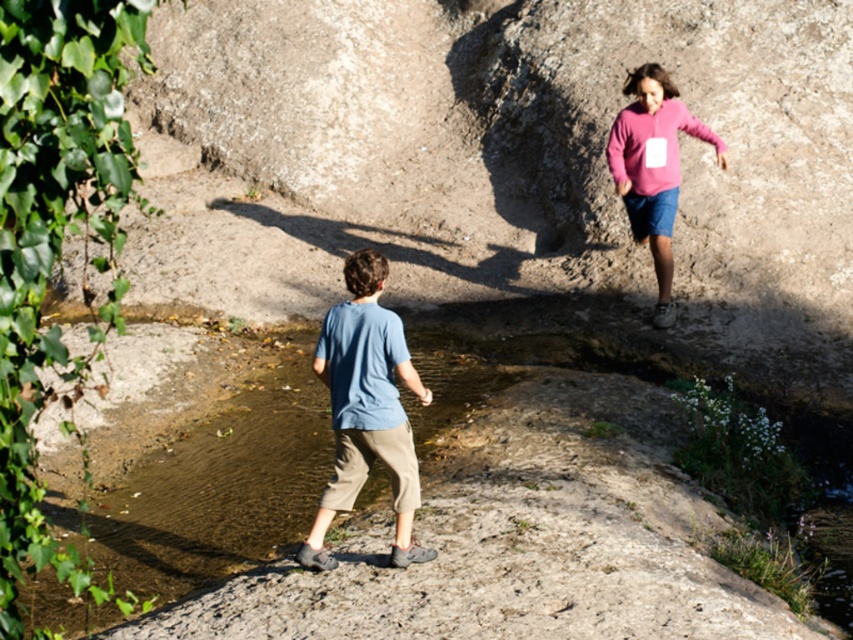
You are a photographer trying to capture the blue cotton shirt at center in the image. Based on its position, which direction should you adjust your camera to focus on it?

The blue cotton shirt at center is located at point coordinates, so you should adjust your camera towards the center of the image to focus on it.

You are a photographer trying to capture both the blue cotton shirt at center and the pink fleece sweater at upper right in a single frame. Based on their positions, which one will appear closer to the camera?

The blue cotton shirt at center appears closer to the camera because it is not as tall as the pink fleece sweater at upper right, indicating it is positioned nearer to the photographer.